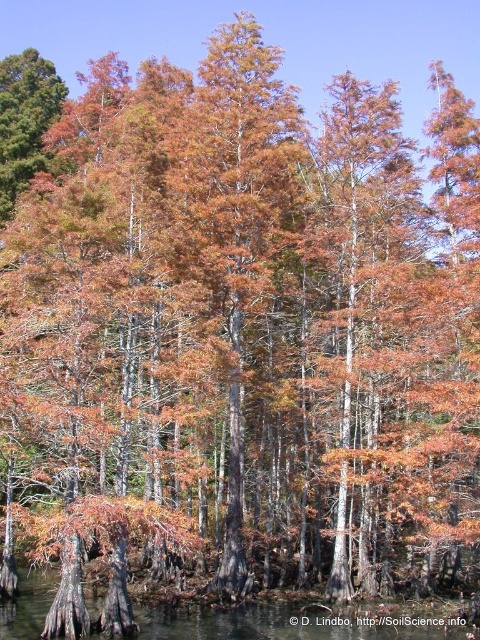
Describe the element at coordinates (238, 232) in the screenshot. I see `orange-brown bark tree at center` at that location.

Does orange-brown bark tree at center have a smaller size compared to clear water at lower center?

Actually, orange-brown bark tree at center might be larger than clear water at lower center.

Between point (252, 374) and point (257, 634), which one is positioned behind?

The point (252, 374) is behind.

Find the location of a particular element. The image size is (480, 640). orange-brown bark tree at center is located at coordinates (238, 232).